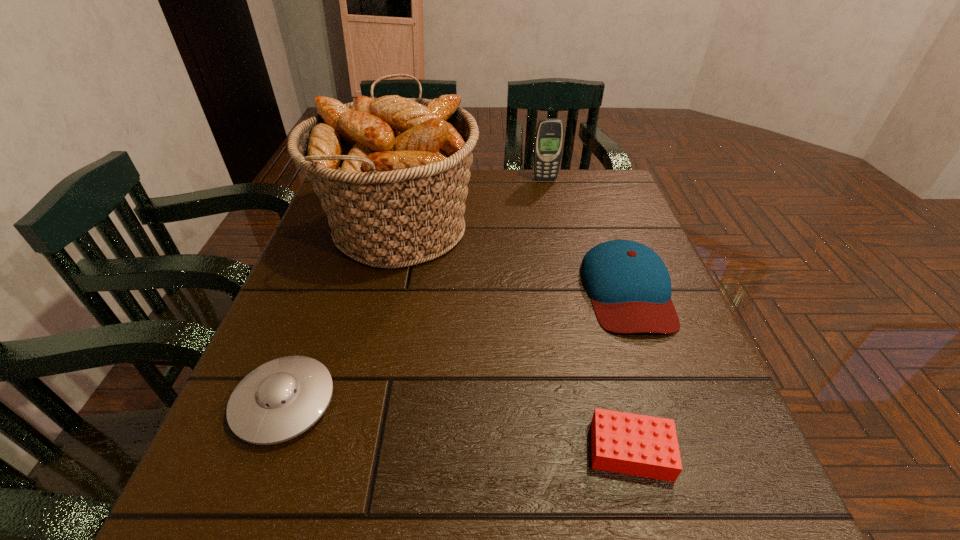
Find the location of `basket`. basket is located at coordinates (391, 173).

Find the location of a particular element. the farthest object is located at coordinates 549,137.

Locate an element on the screen. cellular telephone is located at coordinates (549, 137).

You are a GUI agent. You are given a task and a screenshot of the screen. Output one action in this format:
    pyautogui.click(x=<x>, y=<y>)
    Task: Click on the baseball cap
    This screenshot has width=960, height=540.
    Given the screenshot: What is the action you would take?
    pyautogui.click(x=630, y=287)

I want to click on the fourth tallest object, so click(x=281, y=399).

Where is `Lego`? This screenshot has width=960, height=540. Lego is located at coordinates (639, 445).

The image size is (960, 540). What are the coordinates of `free space located 0.340m on the right of the tallest object` in the screenshot? It's located at (616, 227).

Where is `vacant area situated on the screen of the farthest object`? This screenshot has height=540, width=960. vacant area situated on the screen of the farthest object is located at coordinates (557, 235).

I want to click on vacant point located with the bill of the baseball cap facing forward, so click(692, 470).

Identify the location of vacant area situated 0.180m on the right of the second shortest object. (443, 403).